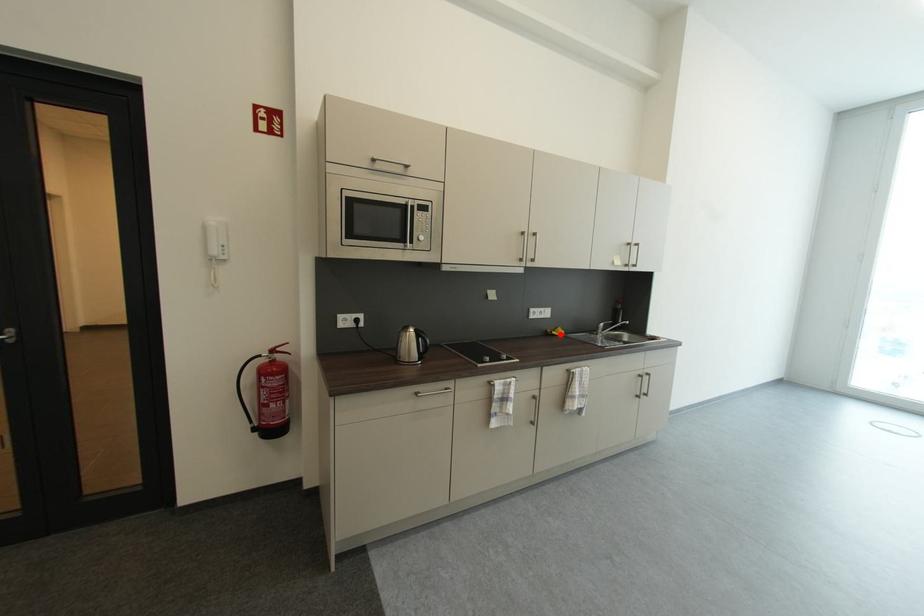
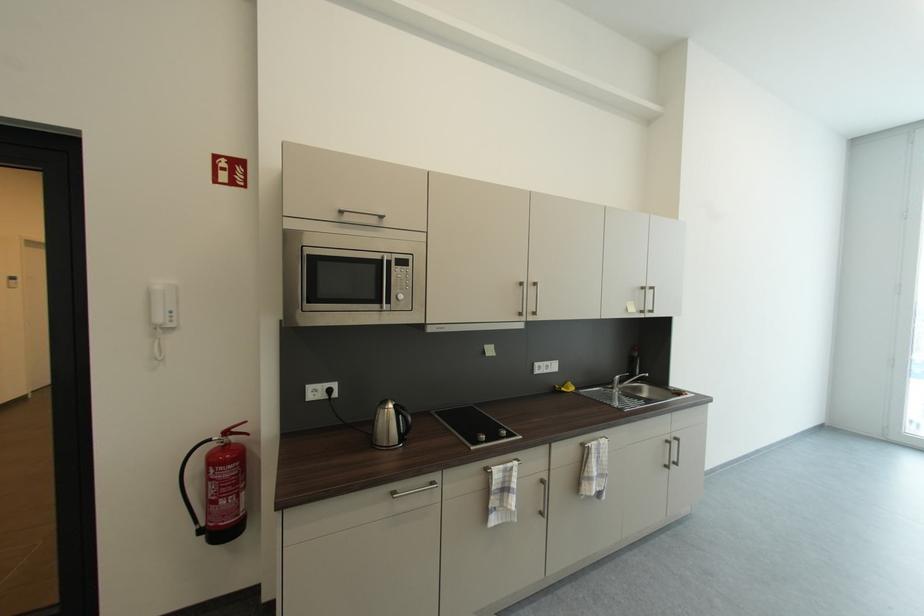
Question: A red point is marked in image1. In image2, is the corresponding 3D point closer to the camera or farther? Reply with the corresponding letter.

Choices:
 (A) The corresponding 3D point is closer.
 (B) The corresponding 3D point is farther.

Answer: (B)